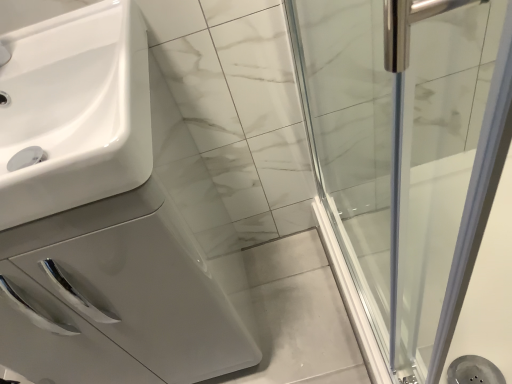
In order to face white glossy sink at left, should I rotate leftwards or rightwards?

To align with it, rotate left about 17.415°.

The height and width of the screenshot is (384, 512). What do you see at coordinates (99, 216) in the screenshot?
I see `white glossy sink at left` at bounding box center [99, 216].

The image size is (512, 384). I want to click on white glossy sink at left, so (99, 216).

What is the approximate width of white glossy sink at left?

white glossy sink at left is 16.85 inches wide.

The image size is (512, 384). What do you see at coordinates (75, 110) in the screenshot?
I see `white glossy sink at left` at bounding box center [75, 110].

In order to face white glossy sink at left, should I rotate leftwards or rightwards?

Turn left by 26.304 degrees to look at white glossy sink at left.

Locate an element on the screen. This screenshot has width=512, height=384. white glossy sink at left is located at coordinates (75, 110).

Locate an element on the screen. This screenshot has height=384, width=512. white glossy sink at left is located at coordinates (99, 216).

Considering the relative positions of white glossy sink at left and white glossy sink at left in the image provided, is white glossy sink at left to the left of white glossy sink at left from the viewer's perspective?

Yes, white glossy sink at left is to the left of white glossy sink at left.

Which object is further away from the camera taking this photo, white glossy sink at left or white glossy sink at left?

white glossy sink at left is more distant.

Between point (74, 62) and point (114, 123), which one is positioned behind?

The point (74, 62) is farther from the camera.

From the image's perspective, is white glossy sink at left beneath white glossy sink at left?

No, from the image's perspective, white glossy sink at left is not below white glossy sink at left.

From a real-world perspective, is white glossy sink at left over white glossy sink at left?

Indeed, from a real-world perspective, white glossy sink at left stands above white glossy sink at left.

Which of these two, white glossy sink at left or white glossy sink at left, is thinner?

Thinner between the two is white glossy sink at left.

Considering the sizes of objects white glossy sink at left and white glossy sink at left in the image provided, who is taller, white glossy sink at left or white glossy sink at left?

white glossy sink at left.

Who is bigger, white glossy sink at left or white glossy sink at left?

Bigger between the two is white glossy sink at left.

Could white glossy sink at left be considered to be inside white glossy sink at left?

Actually, white glossy sink at left is outside white glossy sink at left.

Can you see white glossy sink at left touching white glossy sink at left?

There is a gap between white glossy sink at left and white glossy sink at left.

Is white glossy sink at left aimed at white glossy sink at left?

No, white glossy sink at left is not aimed at white glossy sink at left.

How many degrees apart are the facing directions of white glossy sink at left and white glossy sink at left?

The angular difference between white glossy sink at left and white glossy sink at left is 0.271 degrees.

Based on the photo, how far apart are white glossy sink at left and white glossy sink at left?

white glossy sink at left is 4.88 inches away from white glossy sink at left.

Locate an element on the screen. This screenshot has height=384, width=512. sink that appears above the white glossy sink at left (from a real-world perspective) is located at coordinates (75, 110).

Between white glossy sink at left and white glossy sink at left, which one appears on the left side from the viewer's perspective?

From the viewer's perspective, white glossy sink at left appears more on the left side.

In the scene shown: In the image, is white glossy sink at left positioned in front of or behind white glossy sink at left?

Visually, white glossy sink at left is located behind white glossy sink at left.

Is point (122, 211) farther from camera compared to point (28, 221)?

Yes.

From the image's perspective, which is below, white glossy sink at left or white glossy sink at left?

white glossy sink at left, from the image's perspective.

From a real-world perspective, which object stands above the other?

From a 3D spatial view, white glossy sink at left is above.

Is white glossy sink at left thinner than white glossy sink at left?

Incorrect, the width of white glossy sink at left is not less than that of white glossy sink at left.

Considering the relative sizes of white glossy sink at left and white glossy sink at left in the image provided, is white glossy sink at left shorter than white glossy sink at left?

Incorrect, the height of white glossy sink at left does not fall short of that of white glossy sink at left.

Is white glossy sink at left bigger than white glossy sink at left?

Yes.

Choose the correct answer: Is white glossy sink at left inside white glossy sink at left or outside it?

The correct answer is: outside.

Are white glossy sink at left and white glossy sink at left beside each other?

No, white glossy sink at left is not with white glossy sink at left.

Is white glossy sink at left at the back of white glossy sink at left?

No, white glossy sink at left is not facing away from white glossy sink at left.

I want to click on sink lying in front of the white glossy sink at left, so click(75, 110).

Where is `porcelain below the white glossy sink at left (from a real-world perspective)`? porcelain below the white glossy sink at left (from a real-world perspective) is located at coordinates (99, 216).

Locate an element on the screen. sink positioned vertically above the white glossy sink at left (from a real-world perspective) is located at coordinates (75, 110).